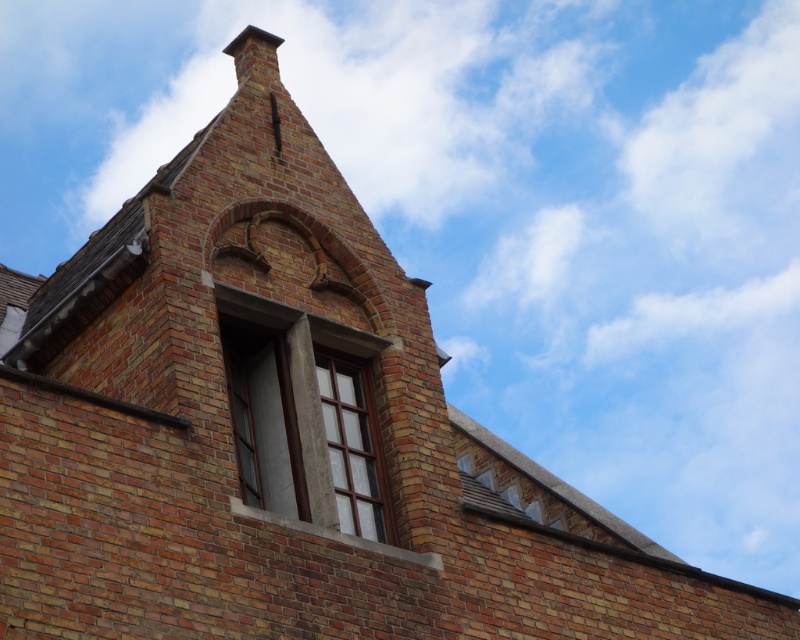
Does point (332, 516) lie behind point (380, 513)?

No, it is not.

Between matte glass window at center and clear glass window at upper center, which one has less height?

Standing shorter between the two is matte glass window at center.

Between point (336, 429) and point (324, 388), which one is positioned behind?

Point (324, 388)

The height and width of the screenshot is (640, 800). I want to click on matte glass window at center, so click(306, 413).

Who is taller, matte glass window at center or matte gray stone window at center?

With more height is matte gray stone window at center.

Between matte glass window at center and matte gray stone window at center, which one is positioned lower?

Positioned lower is matte glass window at center.

Find the location of a particular element. The width and height of the screenshot is (800, 640). matte glass window at center is located at coordinates coord(306,413).

Where is `matte glass window at center`? This screenshot has width=800, height=640. matte glass window at center is located at coordinates (306, 413).

Which of these two, matte gray stone window at center or clear glass window at upper center, stands taller?

With more height is matte gray stone window at center.

The width and height of the screenshot is (800, 640). What do you see at coordinates (264, 419) in the screenshot?
I see `matte gray stone window at center` at bounding box center [264, 419].

Is point (242, 385) closer to viewer compared to point (376, 506)?

No, it is not.

Image resolution: width=800 pixels, height=640 pixels. Identify the location of matte gray stone window at center. pos(264,419).